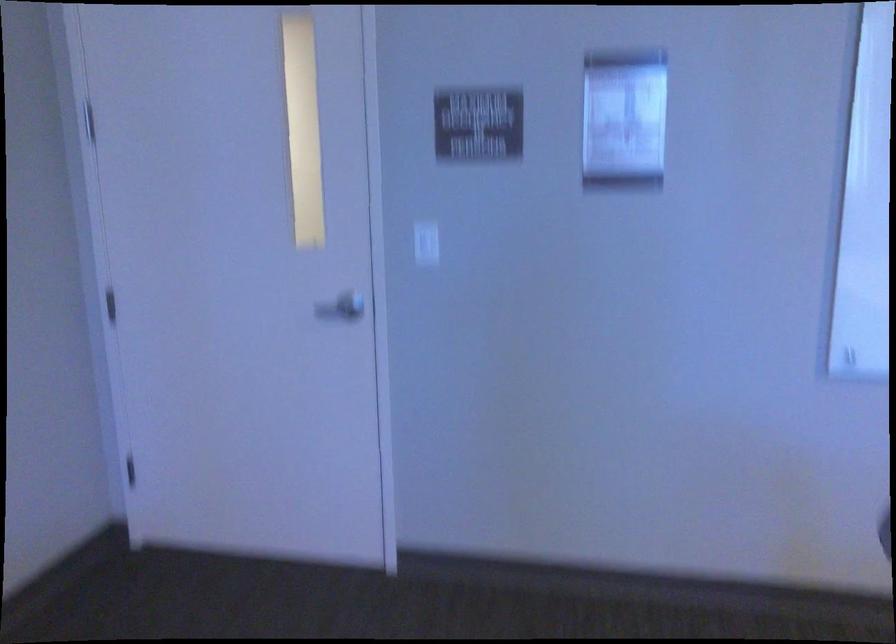
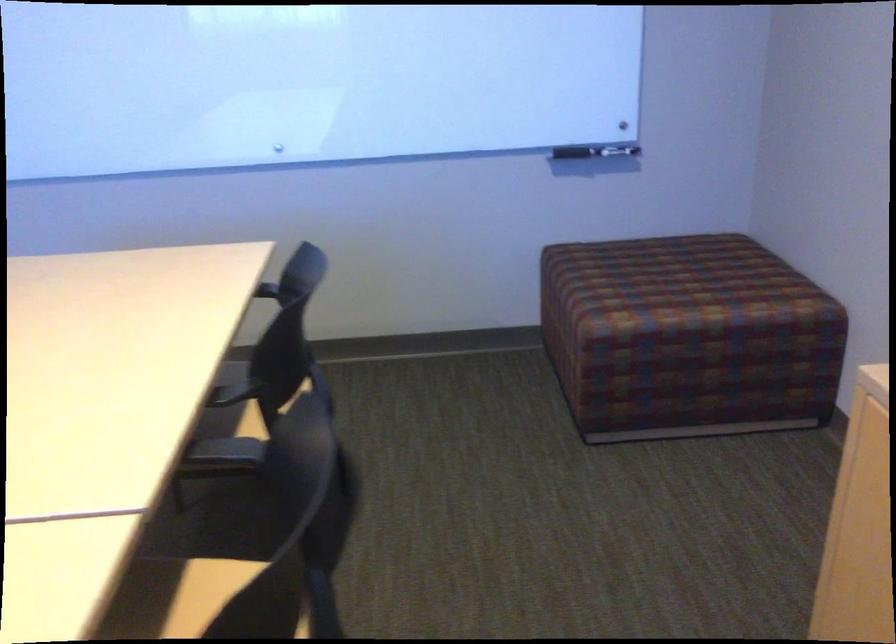
In a continuous first-person perspective shot, in which direction is the camera moving?

The cameraman moved toward right, backward.